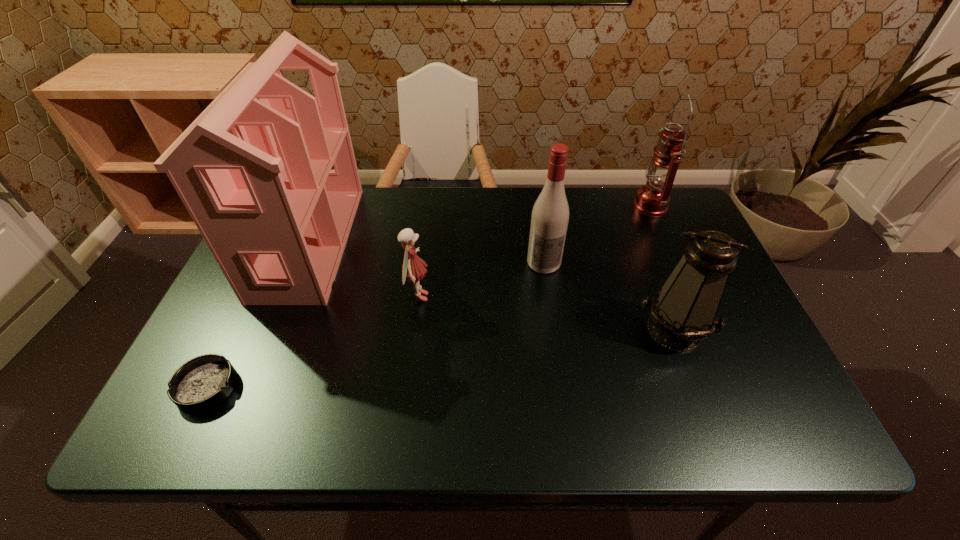
Where is `free spot between the doll and the ashtray`? free spot between the doll and the ashtray is located at coordinates tap(312, 342).

Where is `free spot between the fourth object from right to left and the alcohol`? The height and width of the screenshot is (540, 960). free spot between the fourth object from right to left and the alcohol is located at coordinates (481, 280).

Image resolution: width=960 pixels, height=540 pixels. In order to click on free space between the nearest object and the third object from right to left in this screenshot , I will do `click(375, 325)`.

Find the location of a particular element. The height and width of the screenshot is (540, 960). empty space that is in between the tallest object and the farther oil lamp is located at coordinates pyautogui.click(x=480, y=224).

Locate an element on the screen. Image resolution: width=960 pixels, height=540 pixels. free space between the shortest object and the fifth tallest object is located at coordinates (312, 342).

Identify the location of unoccupied area between the alcohol and the ashtray. (375, 325).

The height and width of the screenshot is (540, 960). I want to click on vacant space that is in between the shorter oil lamp and the alcohol, so click(x=609, y=296).

This screenshot has height=540, width=960. I want to click on vacant point located between the nearest object and the dollhouse, so click(x=258, y=314).

The width and height of the screenshot is (960, 540). Find the location of `object that is the third nearest to the third object from right to left`. object that is the third nearest to the third object from right to left is located at coordinates (652, 200).

Where is `object that ranks as the fourth closest to the doll`? The height and width of the screenshot is (540, 960). object that ranks as the fourth closest to the doll is located at coordinates (684, 311).